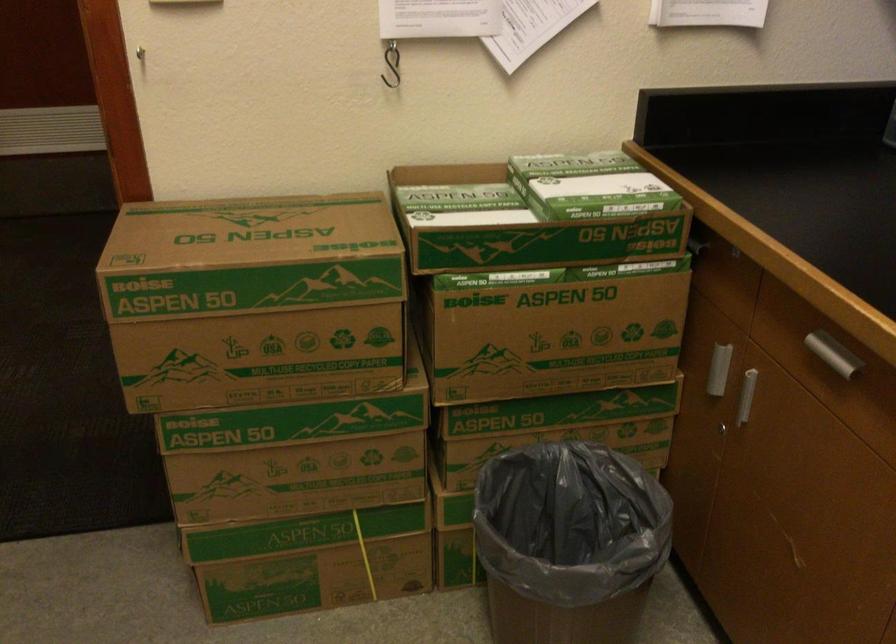
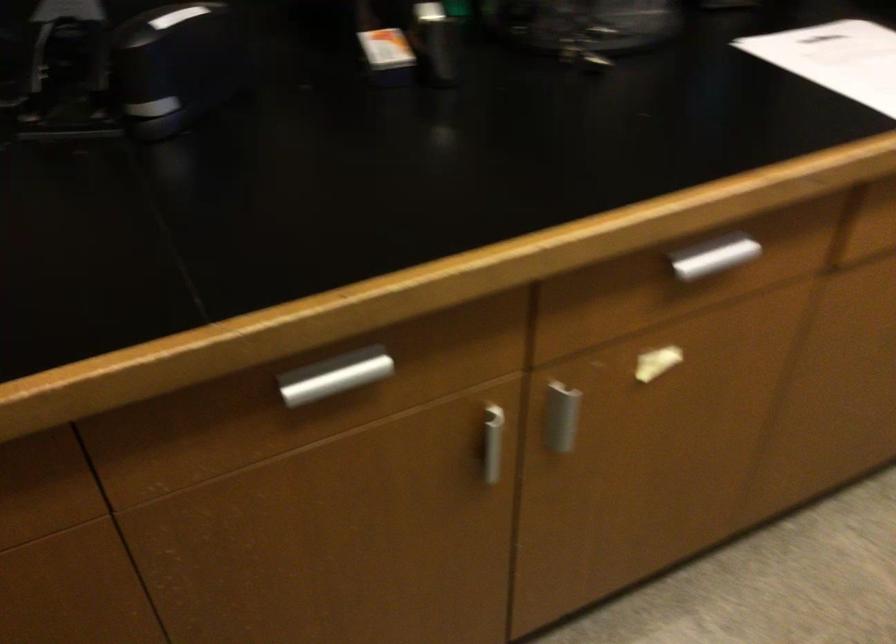
The images are taken continuously from a first-person perspective. In which direction is your viewpoint rotating?

The rotation direction of the camera is right-down.